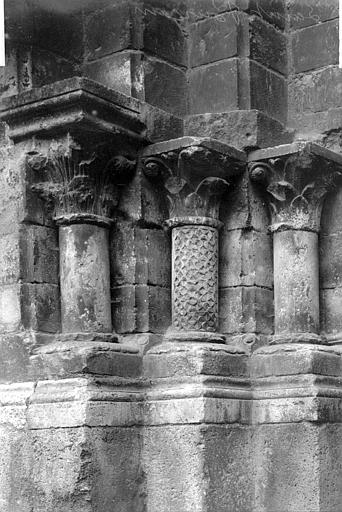
You are a GUI agent. You are given a task and a screenshot of the screen. Output one action in this format:
    pyautogui.click(x=<x>, y=<y>)
    Task: Click on the smooth columns
    The height and width of the screenshot is (512, 342).
    Given the screenshot: What is the action you would take?
    pyautogui.click(x=87, y=286), pyautogui.click(x=293, y=282)